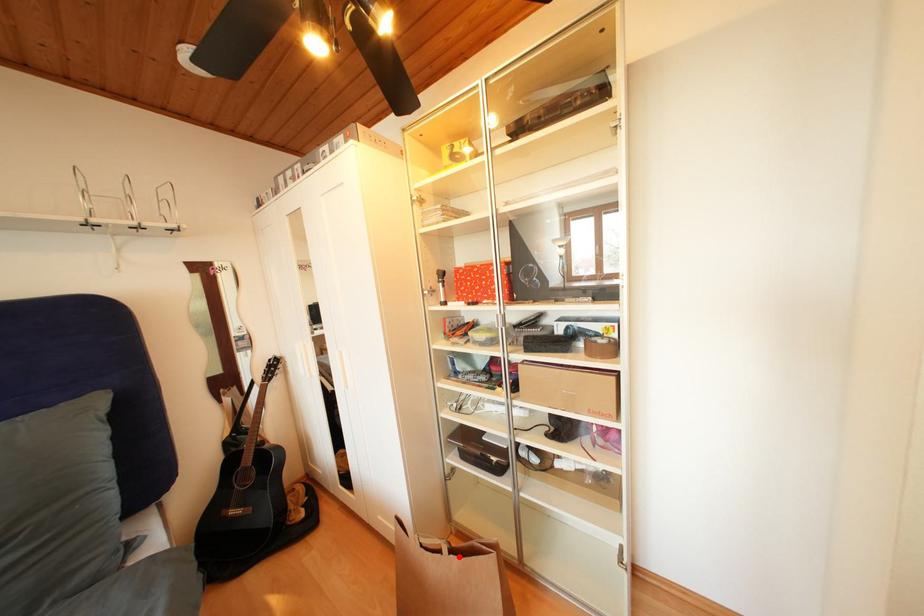
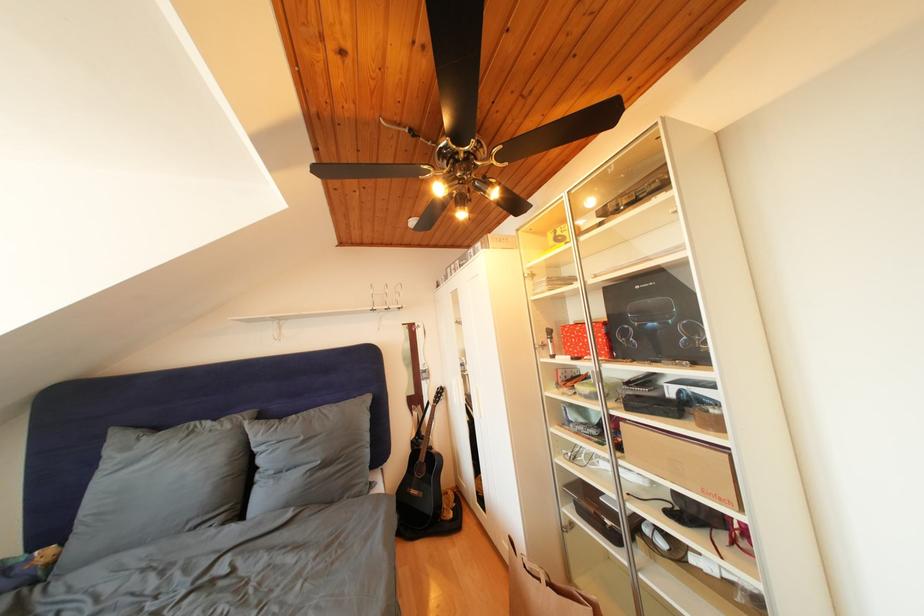
Question: I am providing you with two images of the same scene from different viewpoints. Given a red point in image1, look at the same physical point in image2. Is it:

Choices:
 (A) Closer to the viewpoint
 (B) Farther from the viewpoint

Answer: (B)